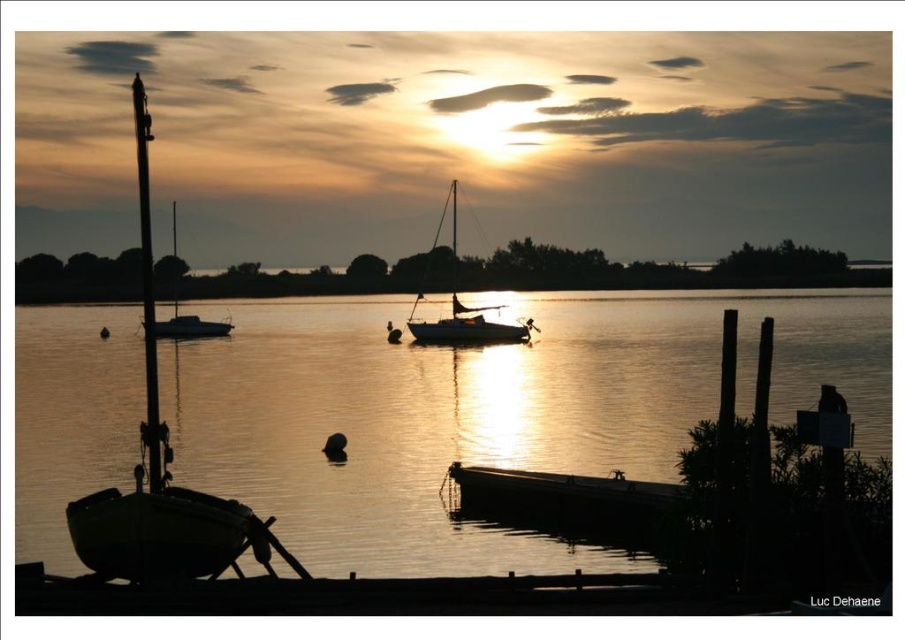
Question: Is silvery water at boat left in front of white glossy sailboat at center?

Choices:
 (A) no
 (B) yes

Answer: (B)

Question: Is green matte sailboat at left below white glossy sailboat at center?

Choices:
 (A) no
 (B) yes

Answer: (B)

Question: Is green matte sailboat at left above white glossy sailboat at center?

Choices:
 (A) yes
 (B) no

Answer: (B)

Question: Which of the following is the closest to the observer?

Choices:
 (A) (177, 264)
 (B) (170, 497)
 (C) (275, 422)

Answer: (B)

Question: Which of the following is the farthest from the observer?

Choices:
 (A) white glossy sailboat at center
 (B) silhouette sailboat at center
 (C) green matte sailboat at left

Answer: (A)

Question: Which point appears closest to the camera in this image?

Choices:
 (A) (176, 273)
 (B) (470, 316)
 (C) (262, 376)

Answer: (C)